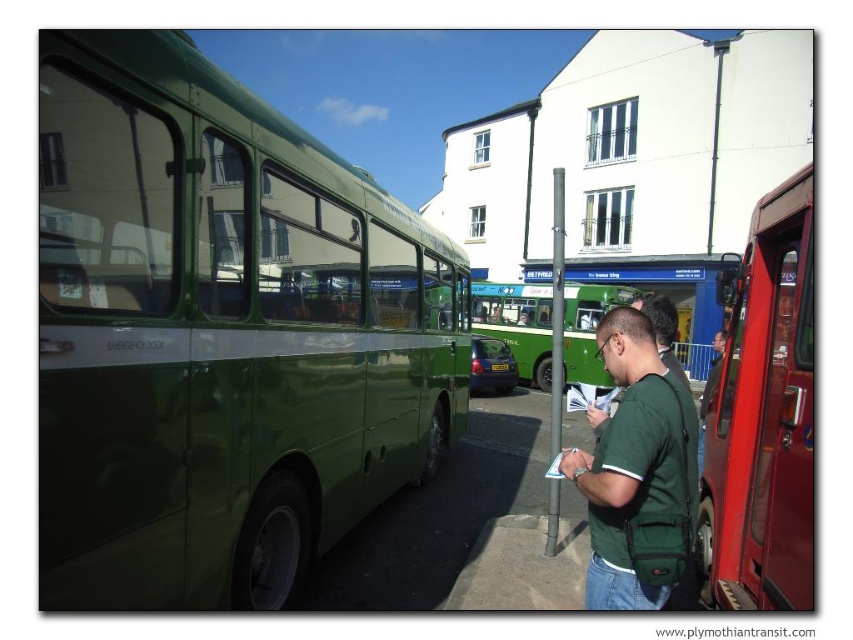
You are a passenger waiting at the bus stop and see the metallic red bus at right and the green matte shirt at center. Which object is positioned lower in the image?

The metallic red bus at right is positioned lower than the green matte shirt at center in the image.

You are a bus driver who needs to park your green matte bus at left at the green plastic bus stop at center. Based on the distance provided, can you safely park your vehicle without needing to reverse?

The distance between the green matte bus at left and the green plastic bus stop at center is 16.91 meters. Since this distance is sufficient for a bus driver to maneuver forward without needing to reverse, you can safely park your vehicle.